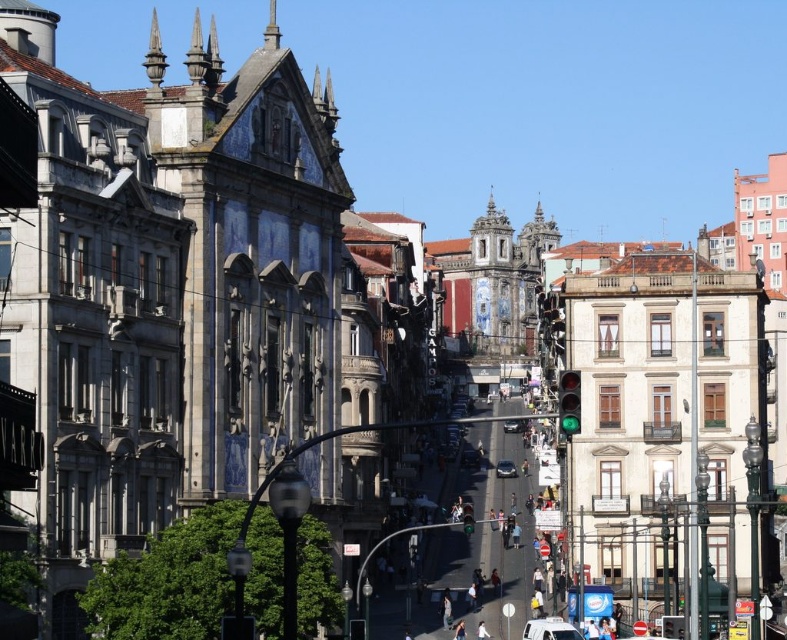
You are a delivery driver trying to park your vehicle in a narrow alley between the buildings. Your car is the same size as the shiny silver car at center. Can you fit your car into a parking spot that is currently occupied by the white matte car at center?

The white matte car at center is wider than the shiny silver car at center. Since your car is the same size as the shiny silver car at center, it may not fit into the parking spot occupied by the white matte car at center, as the spot might be sized for the wider vehicle.

You are a pedestrian standing at the edge of the street. You see a shiny silver sedan at center and a shiny silver car at center. Which one is closer to you?

The shiny silver sedan at center is closer to you because it is in front of the shiny silver car at center.